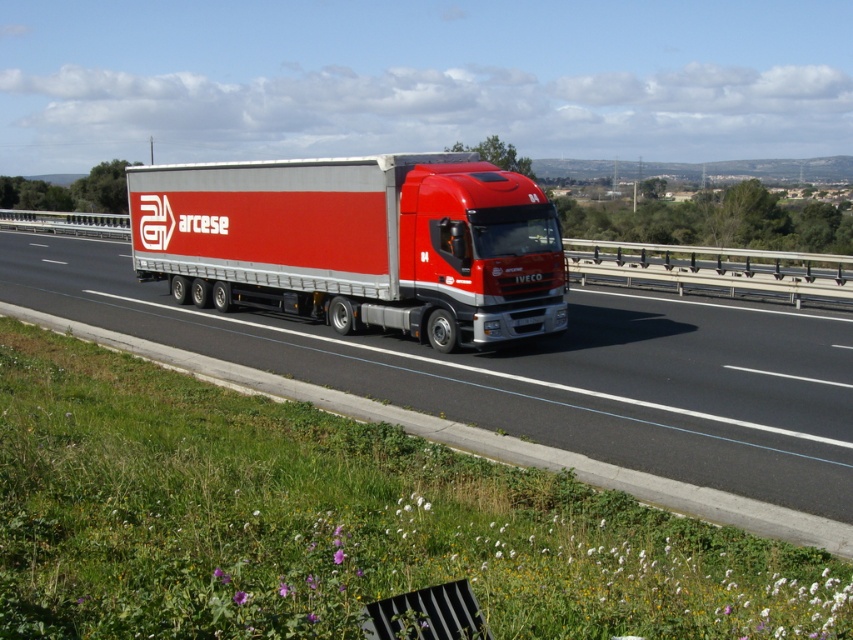
Question: In this image, where is metallic silver truck at center located relative to metallic silver trailer truck at center?

Choices:
 (A) above
 (B) below

Answer: (B)

Question: Which point appears farthest from the camera in this image?

Choices:
 (A) (279, 257)
 (B) (577, 348)

Answer: (A)

Question: Which object is closer to the camera taking this photo?

Choices:
 (A) metallic silver trailer truck at center
 (B) metallic silver truck at center

Answer: (B)

Question: From the image, what is the correct spatial relationship of metallic silver truck at center in relation to metallic silver trailer truck at center?

Choices:
 (A) below
 (B) above

Answer: (A)

Question: Among these objects, which one is nearest to the camera?

Choices:
 (A) metallic silver trailer truck at center
 (B) metallic silver truck at center

Answer: (B)

Question: Where is metallic silver truck at center located in relation to metallic silver trailer truck at center in the image?

Choices:
 (A) below
 (B) above

Answer: (A)